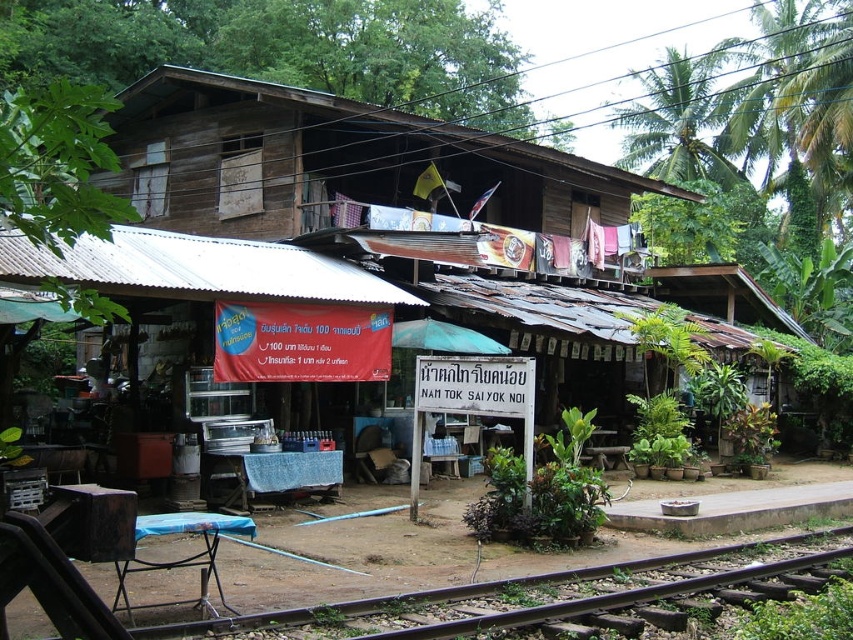
Is wooden hut at center shorter than brown wooden train track at lower center?

No.

Between wooden hut at center and brown wooden train track at lower center, which one is positioned higher?

wooden hut at center is higher up.

Does point (592, 339) come closer to viewer compared to point (585, 573)?

No.

Locate an element on the screen. This screenshot has width=853, height=640. wooden hut at center is located at coordinates (347, 173).